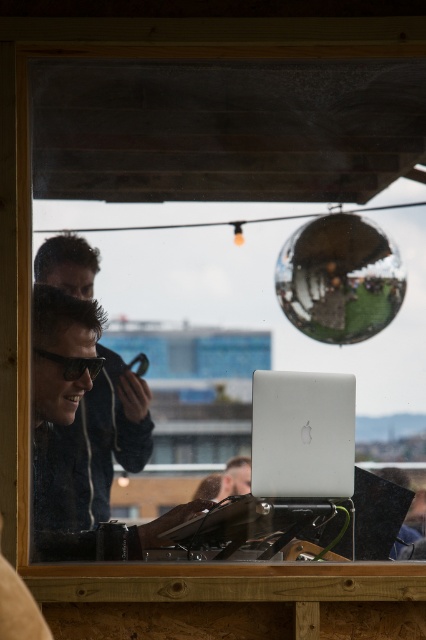
Between shiny metallic sphere at upper center and satin silver laptop at center, which one appears on the left side from the viewer's perspective?

satin silver laptop at center

Is point (360, 228) positioned after point (256, 381)?

Yes, it is.

Does point (383, 253) lie behind point (336, 372)?

That is True.

Where is `shiny metallic sphere at upper center`? The width and height of the screenshot is (426, 640). shiny metallic sphere at upper center is located at coordinates (339, 278).

In the scene shown: Is matte black sunglasses at lower left to the left of satin silver laptop at center from the viewer's perspective?

Indeed, matte black sunglasses at lower left is positioned on the left side of satin silver laptop at center.

Is point (95, 426) behind point (276, 376)?

No.

Find the location of a particular element. The height and width of the screenshot is (640, 426). matte black sunglasses at lower left is located at coordinates (97, 445).

Does satin silver laptop at center have a lesser width compared to black matte goggles at center?

In fact, satin silver laptop at center might be wider than black matte goggles at center.

Is point (344, 474) more distant than point (40, 349)?

Yes.

This screenshot has width=426, height=640. What are the coordinates of `satin silver laptop at center` in the screenshot? It's located at (302, 433).